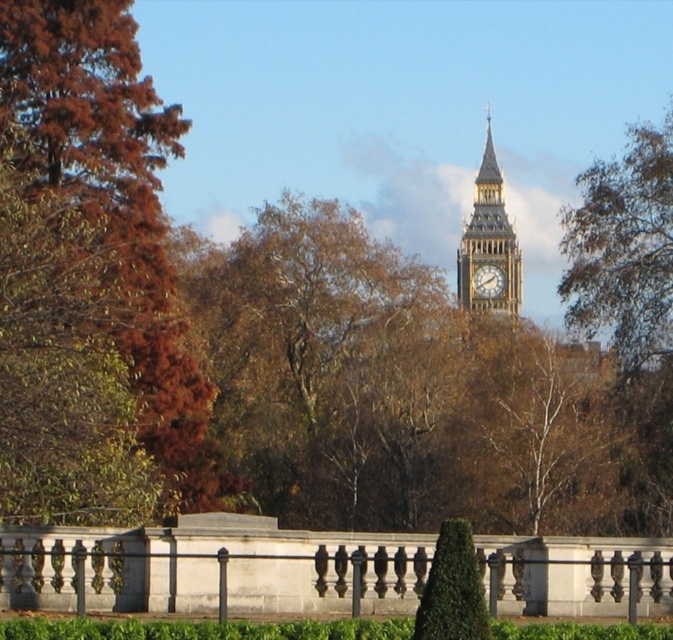
Who is higher up, brown leafy tree at left or green textured hedge at center?

Positioned higher is brown leafy tree at left.

Is brown leafy tree at left wider than green textured hedge at center?

Yes, brown leafy tree at left is wider than green textured hedge at center.

Is point (9, 83) positioned in front of point (454, 628)?

No, it is behind (454, 628).

Where is `brown leafy tree at left`? brown leafy tree at left is located at coordinates (87, 276).

Does green textured hedge at center have a greater height compared to gold textured clock at center?

Indeed, green textured hedge at center has a greater height compared to gold textured clock at center.

Identify the location of green textured hedge at center. (452, 588).

Where is `green textured hedge at center`? The height and width of the screenshot is (640, 673). green textured hedge at center is located at coordinates (452, 588).

Does brown leafy tree at left have a lesser width compared to golden stone clock tower at upper center?

No.

Is brown leafy tree at left shorter than golden stone clock tower at upper center?

In fact, brown leafy tree at left may be taller than golden stone clock tower at upper center.

Describe the element at coordinates (87, 276) in the screenshot. I see `brown leafy tree at left` at that location.

Find the location of `brown leafy tree at left`. brown leafy tree at left is located at coordinates (87, 276).